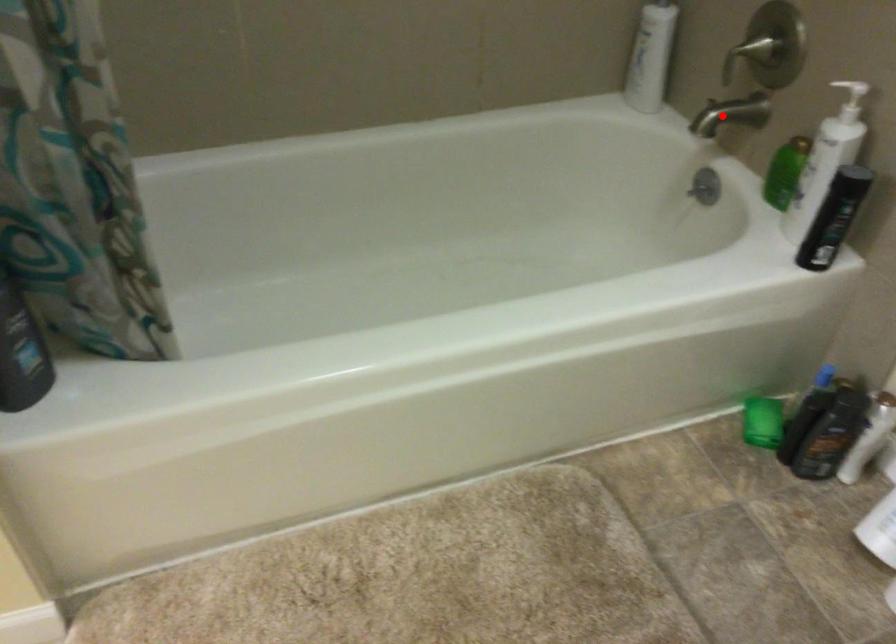
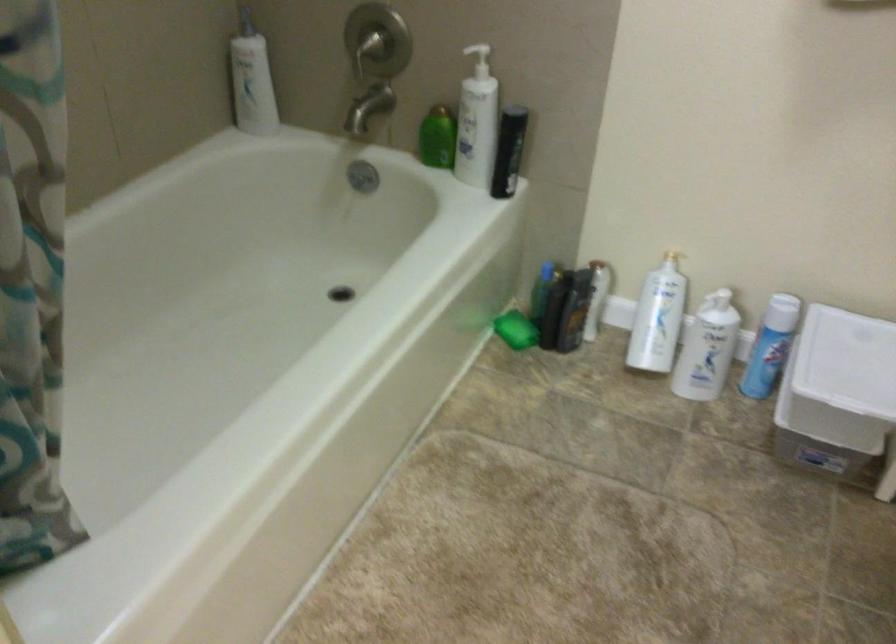
Find the pixel in the second image that matches the highlighted location in the first image.

(368, 108)